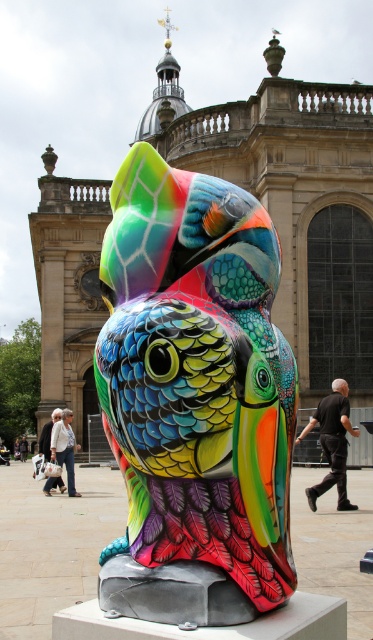
Does black cotton shirt at center come behind dark gray pants at lower left?

No, black cotton shirt at center is closer to the viewer.

Does black cotton shirt at center have a greater height compared to dark gray pants at lower left?

Indeed, black cotton shirt at center has a greater height compared to dark gray pants at lower left.

Describe the element at coordinates (331, 442) in the screenshot. I see `black cotton shirt at center` at that location.

The image size is (373, 640). I want to click on black cotton shirt at center, so click(331, 442).

Is multicolored painted bird at center to the left of white cotton jacket at lower left from the viewer's perspective?

In fact, multicolored painted bird at center is to the right of white cotton jacket at lower left.

Is multicolored painted bird at center bigger than white cotton jacket at lower left?

No.

Image resolution: width=373 pixels, height=640 pixels. What do you see at coordinates (196, 376) in the screenshot?
I see `multicolored painted bird at center` at bounding box center [196, 376].

Image resolution: width=373 pixels, height=640 pixels. I want to click on multicolored painted bird at center, so click(x=196, y=376).

Is point (346, 454) positioned in front of point (61, 410)?

Yes.

Is black cotton shirt at center behind white cotton shirt at lower left?

No, black cotton shirt at center is in front of white cotton shirt at lower left.

Who is more distant from viewer, (296,442) or (61,484)?

Positioned behind is point (61,484).

You are a GUI agent. You are given a task and a screenshot of the screen. Output one action in this format:
    pyautogui.click(x=<x>, y=<y>)
    Task: Click on the black cotton shirt at center
    
    Given the screenshot: What is the action you would take?
    coord(331,442)